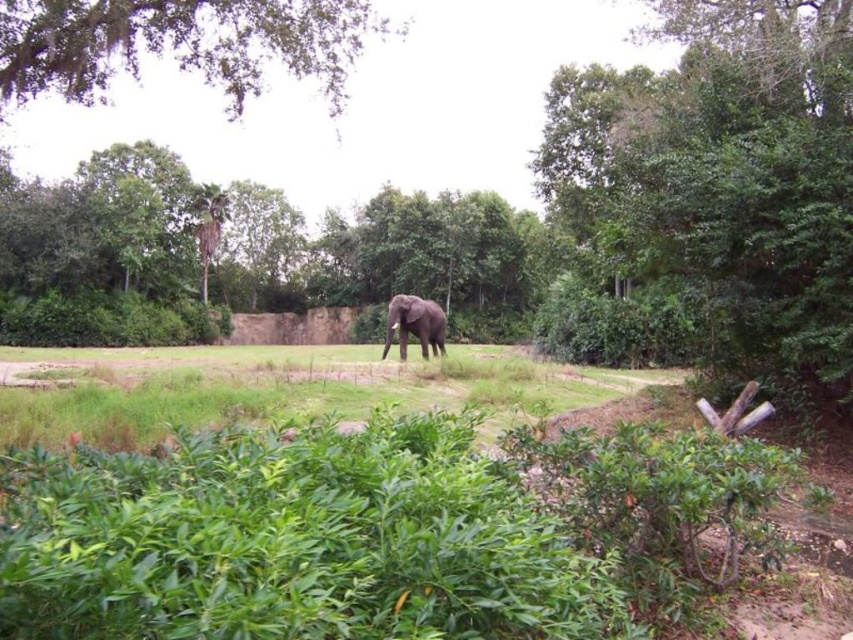
Which is more to the right, green grass at center or gray matte elephant at center?

gray matte elephant at center is more to the right.

Who is more distant from viewer, (241, 406) or (395, 305)?

Positioned behind is point (395, 305).

You are a GUI agent. You are given a task and a screenshot of the screen. Output one action in this format:
    pyautogui.click(x=<x>, y=<y>)
    Task: Click on the green grass at center
    The image size is (853, 640).
    Given the screenshot: What is the action you would take?
    pyautogui.click(x=279, y=387)

Between green leafy tree at right and green grass at center, which one has more height?

With more height is green leafy tree at right.

This screenshot has height=640, width=853. I want to click on green leafy tree at right, so click(723, 180).

At what (x,y) coordinates should I click in order to perform the action: click on green leafy tree at right. Please return your answer as a coordinate pair (x, y). Image resolution: width=853 pixels, height=640 pixels. Looking at the image, I should click on (723, 180).

At what (x,y) coordinates should I click in order to perform the action: click on green leafy tree at right. Please return your answer as a coordinate pair (x, y). This screenshot has width=853, height=640. Looking at the image, I should click on (723, 180).

Between green leafy tree at upper left and gray matte elephant at center, which one has less height?

Standing shorter between the two is gray matte elephant at center.

Does point (107, 64) come farther from viewer compared to point (387, 324)?

No, it is not.

Between point (325, 3) and point (410, 323), which one is positioned in front?

Positioned in front is point (325, 3).

I want to click on green leafy tree at upper left, so click(x=180, y=44).